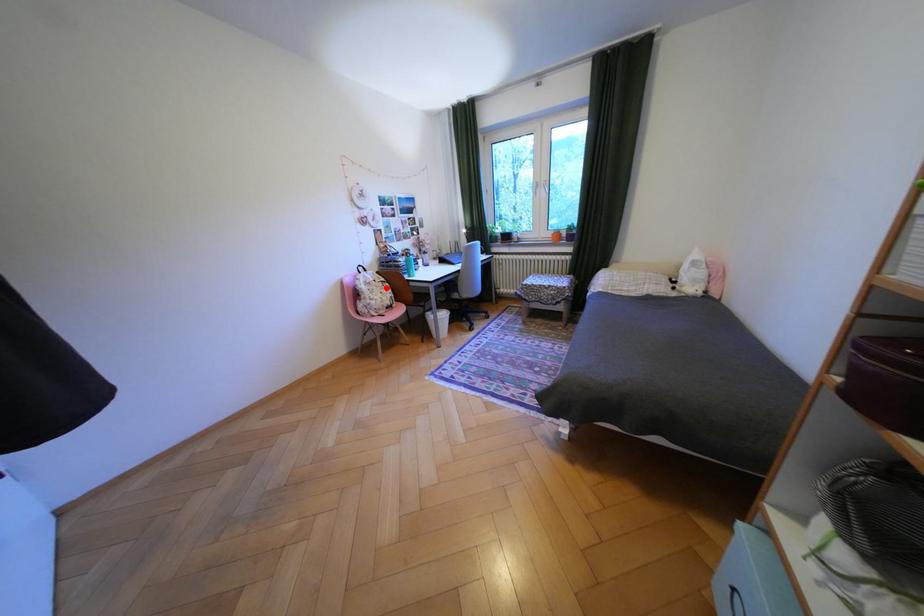
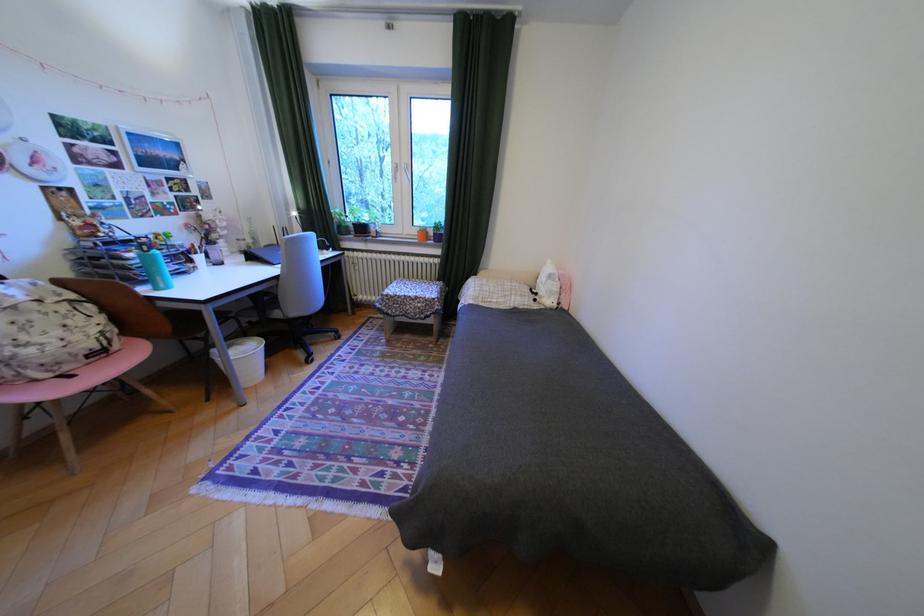
Find the pixel in the second image that matches the highlighted location in the first image.

(49, 317)